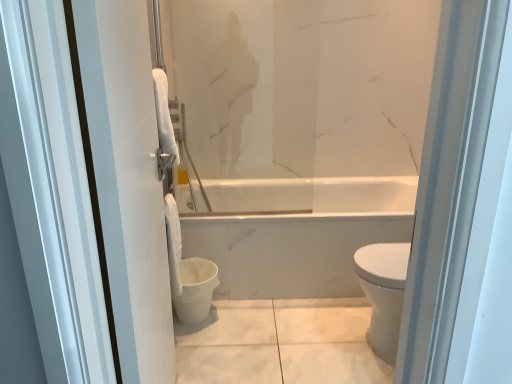
Identify the location of free space in front of white matte toilet bowl at lower center. (203, 349).